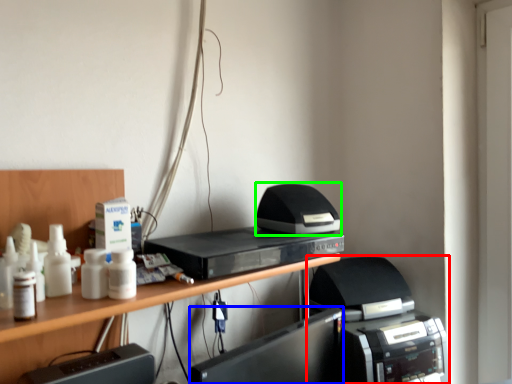
Question: Which is farther away from printer (highlighted by a red box)? register (highlighted by a blue box) or printer (highlighted by a green box)?

Choices:
 (A) register
 (B) printer

Answer: (B)